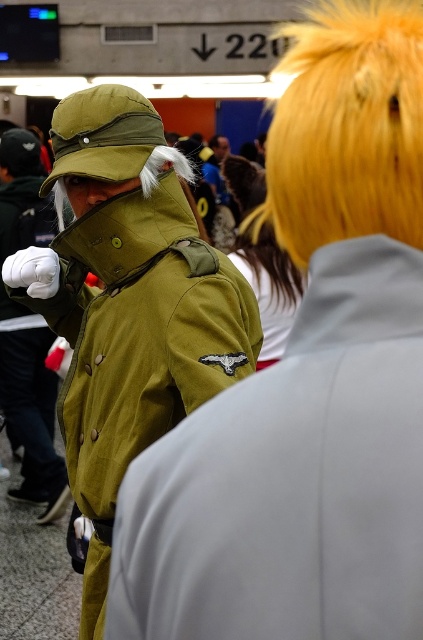
From the picture: You are standing in the convention hall and want to locate the matte green jacket at left. According to the coordinates provided, where should you look?

You should look at point (128, 304) to find the matte green jacket at left.

You are a photographer at the event and need to capture both the shiny golden wig at upper right and the matte green jacket at center in a single frame. Given that your camera has a fixed focal length, which object should you prioritize framing closer to ensure both are visible?

The shiny golden wig at upper right is smaller than the matte green jacket at center. To ensure both are visible, prioritize framing the smaller shiny golden wig at upper right closer to the camera while keeping the matte green jacket at center slightly farther back. This way, both sizes will be adequately captured within the frame.

You are at the convention and want to locate the matte green jacket at left. Where exactly should you look?

You should look at point (128, 304) to find the matte green jacket at left.